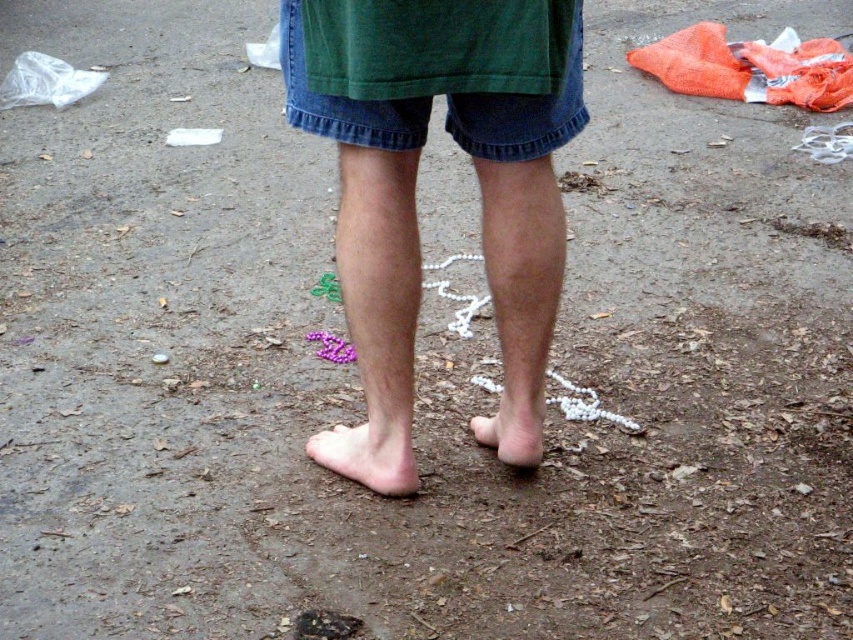
You are a photographer capturing the scene from above. You need to position a light source at a specific coordinate to highlight the pale skin at lower center. What coordinate should you aim for?

A: The light source should be aimed at the coordinate point (369, 452) to highlight the pale skin at lower center.

You are a photographer setting up a shoot in this scene. You need to place a small prop between the smooth skin legs at center and the pink matte toe at lower center. Is there enough space to fit the prop between them?

The smooth skin legs at center is positioned over the pink matte toe at lower center, meaning there is no space between them to place a prop.

You are a photographer trying to capture the details of the pale skin at lower center and the pink matte toe at lower center in the image. Which object would appear larger in the photo?

The pale skin at lower center is bigger than the pink matte toe at lower center, so it would appear larger in the photo.